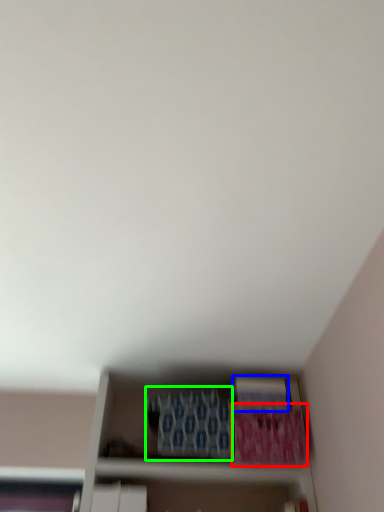
Question: Which object is positioned closest to paperback book (highlighted by a red box)? Select from paperback book (highlighted by a blue box) and paperback book (highlighted by a green box).

Choices:
 (A) paperback book
 (B) paperback book

Answer: (A)